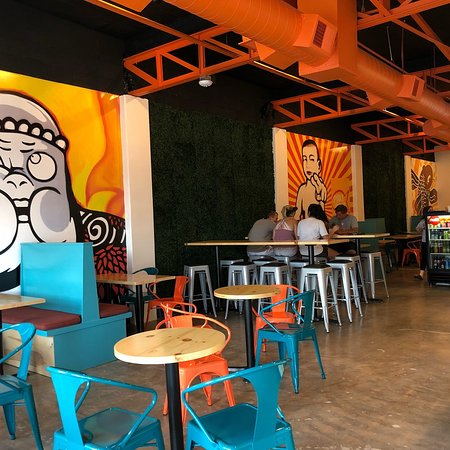
Locate an element on the screen. This screenshot has height=450, width=450. large rectangle table is located at coordinates (x=220, y=243), (x=373, y=234).